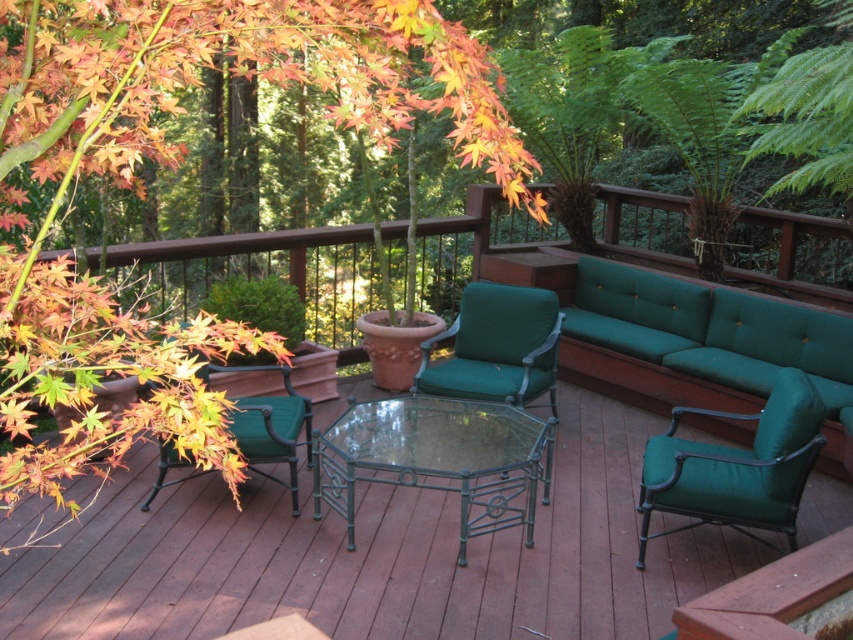
You are standing at point [540,212] and want to walk to point [316,550]. Based on the deck layout, will you have to go around any obstacles or can you walk straight?

Point [316,550] is behind point [540,212], so you can walk straight to reach it without needing to go around any obstacles.